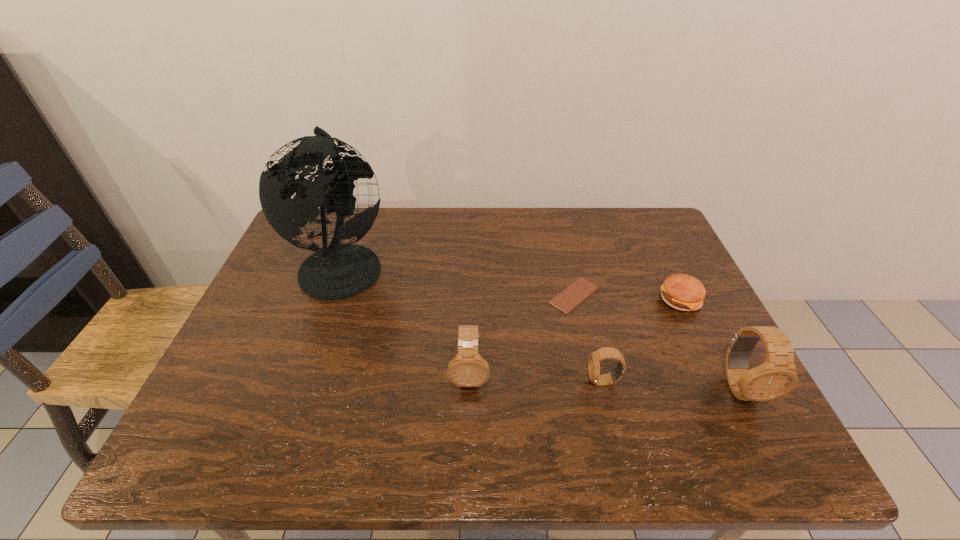
I want to click on vacant space in between the fifth tallest object and the fourth shortest object, so click(x=575, y=338).

Locate an element on the screen. free space between the hamburger and the shortest object is located at coordinates (627, 298).

Where is `free area in between the shortest watch and the chocolate bar`? The width and height of the screenshot is (960, 540). free area in between the shortest watch and the chocolate bar is located at coordinates (588, 338).

In order to click on free point between the rightmost watch and the third shortest object in this screenshot , I will do `click(671, 384)`.

Where is `free point between the leftmost object and the fifth object from right to left`? The image size is (960, 540). free point between the leftmost object and the fifth object from right to left is located at coordinates (406, 320).

At what (x,y) coordinates should I click in order to perform the action: click on the second closest object relative to the shortest watch. Please return your answer as a coordinate pair (x, y). The width and height of the screenshot is (960, 540). Looking at the image, I should click on (777, 376).

I want to click on the second closest object relative to the hamburger, so click(x=777, y=376).

Locate an element on the screen. the second closest watch relative to the second shortest object is located at coordinates (594, 359).

At what (x,y) coordinates should I click in order to perform the action: click on the closest watch to the second object from left to right. Please return your answer as a coordinate pair (x, y). Looking at the image, I should click on (594, 359).

Where is `blank area in the image that satisfies the following two spatial constraints: 1. on the front side of the hamburger; 2. on the face of the second watch from left to right`? The image size is (960, 540). blank area in the image that satisfies the following two spatial constraints: 1. on the front side of the hamburger; 2. on the face of the second watch from left to right is located at coordinates (719, 381).